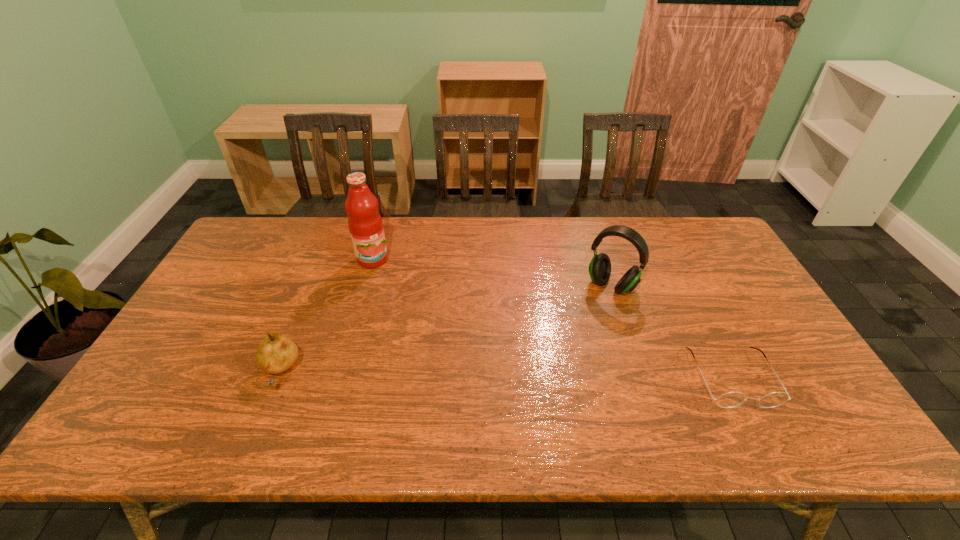
This screenshot has height=540, width=960. I want to click on vacant area between the rightmost object and the leftmost object, so [506, 375].

The image size is (960, 540). In order to click on unoccupied area between the spectacles and the second object from left to right in this screenshot , I will do `click(552, 319)`.

Locate an element on the screen. The image size is (960, 540). vacant area that lies between the second object from left to right and the second farthest object is located at coordinates (492, 272).

The image size is (960, 540). Identify the location of vacant area that lies between the second shortest object and the spectacles. (506, 375).

At what (x,y) coordinates should I click in order to perform the action: click on free space between the farthest object and the third tallest object. Please return your answer as a coordinate pair (x, y). Looking at the image, I should click on click(326, 316).

Identify which object is the nearest to the spectacles. Please provide its 2D coordinates. Your answer should be formatted as a tuple, i.e. [(x, y)], where the tuple contains the x and y coordinates of a point satisfying the conditions above.

[(600, 266)]

Where is `object that can be found as the closest to the spectacles`? object that can be found as the closest to the spectacles is located at coordinates (600, 266).

At what (x,y) coordinates should I click in order to perform the action: click on vacant space that satisfies the following two spatial constraints: 1. on the back side of the fruit juice; 2. on the right side of the third tallest object. Please return your answer as a coordinate pair (x, y). Looking at the image, I should click on (326, 259).